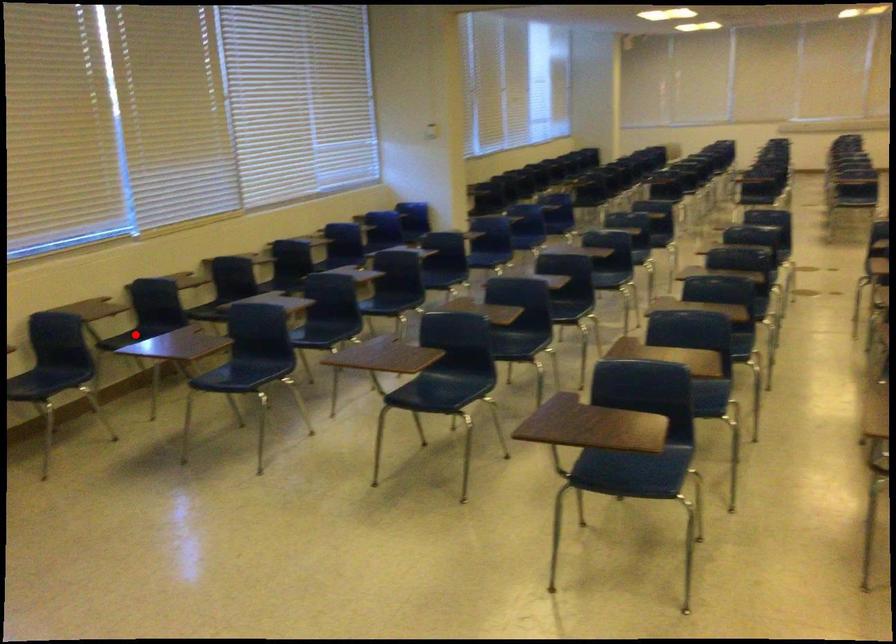
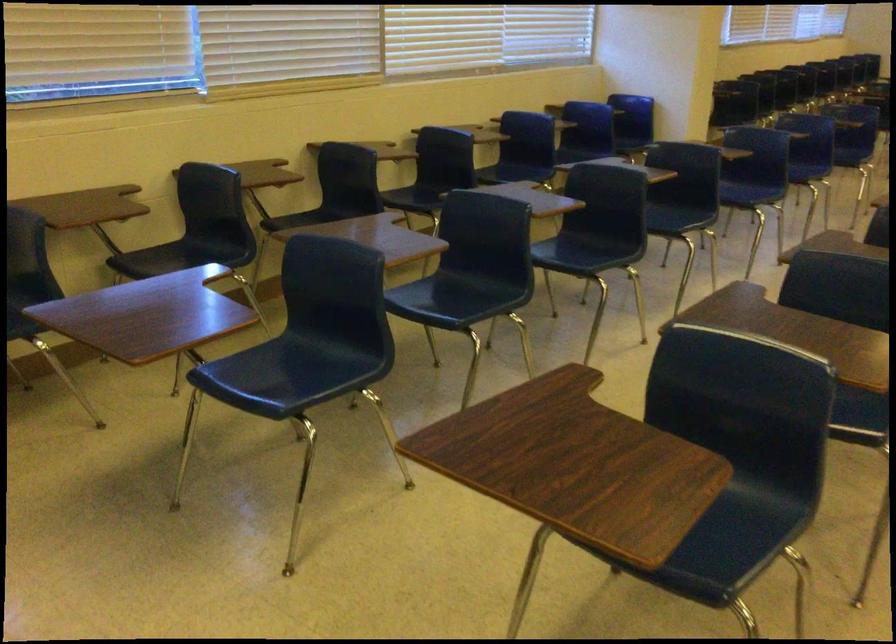
Question: A red point is marked in image1. In image2, is the corresponding 3D point closer to the camera or farther? Reply with the corresponding letter.

Choices:
 (A) The corresponding 3D point is closer.
 (B) The corresponding 3D point is farther.

Answer: (A)